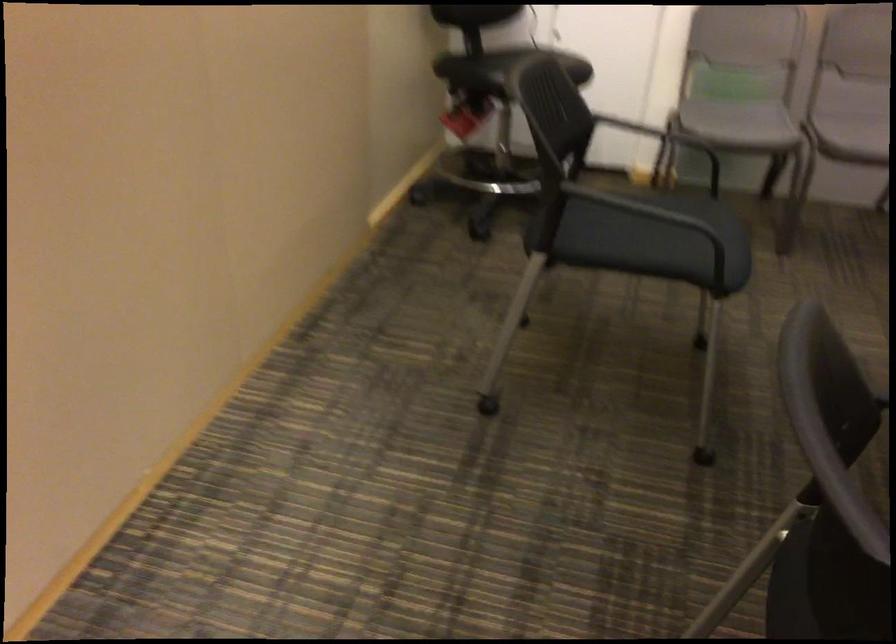
Find where to sit the black office chair seat. Please return your answer as a coordinate pair (x, y).

(503, 69)